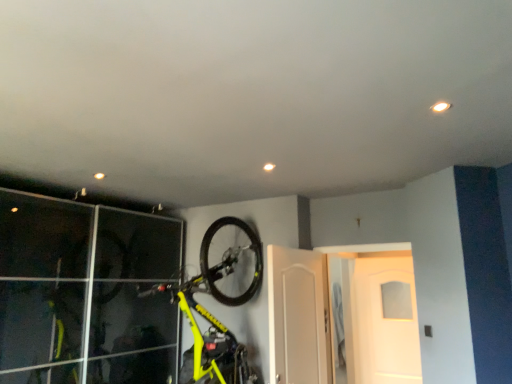
This screenshot has width=512, height=384. Find the location of `white glossy door at center, arranged as the 2th door when viewed from the back`. white glossy door at center, arranged as the 2th door when viewed from the back is located at coordinates (342, 315).

Find the location of `white glossy door at center, the third door when ordered from front to back`. white glossy door at center, the third door when ordered from front to back is located at coordinates (341, 319).

The height and width of the screenshot is (384, 512). I want to click on white glossy door at center, the second door viewed from the front, so click(342, 315).

Does white matte door at center, placed as the 1th door when sorted from front to back, lie behind white glossy door at center, which is the 1th door in back-to-front order?

No, white matte door at center, placed as the 1th door when sorted from front to back, is closer to the viewer.

From a real-world perspective, is white matte door at center, the 3th door in the back-to-front sequence, beneath white glossy door at center, which is the 1th door in back-to-front order?

No, from a real-world perspective, white matte door at center, the 3th door in the back-to-front sequence, is not below white glossy door at center, which is the 1th door in back-to-front order.

Can you confirm if white matte door at center, the 3th door in the back-to-front sequence, is bigger than white glossy door at center, the third door when ordered from front to back?

Actually, white matte door at center, the 3th door in the back-to-front sequence, might be smaller than white glossy door at center, the third door when ordered from front to back.

Are white matte door at center, placed as the 1th door when sorted from front to back, and white glossy door at center, which is the 1th door in back-to-front order, far apart?

white matte door at center, placed as the 1th door when sorted from front to back, is actually quite close to white glossy door at center, which is the 1th door in back-to-front order.

Is white glossy door at center, which is the 1th door in back-to-front order, inside yellow matte bicycle at upper center?

No, white glossy door at center, which is the 1th door in back-to-front order, is located outside of yellow matte bicycle at upper center.

Based on their positions, is yellow matte bicycle at upper center located to the left or right of white glossy door at center, which is the 1th door in back-to-front order?

From the image, it's evident that yellow matte bicycle at upper center is to the left of white glossy door at center, which is the 1th door in back-to-front order.

Is point (252, 292) positioned before point (338, 374)?

Yes, point (252, 292) is in front of point (338, 374).

From the image's perspective, which one is positioned lower, white glossy door at center, which is the 1th door in back-to-front order, or yellow matte bicycle at upper center?

From the image's view, white glossy door at center, which is the 1th door in back-to-front order, is below.

Based on the photo, considering the positions of objects white glossy door at center, the third door when ordered from front to back, and yellow matte bicycle at upper center in the image provided, who is more to the left, white glossy door at center, the third door when ordered from front to back, or yellow matte bicycle at upper center?

Result: Positioned to the left is yellow matte bicycle at upper center.

The width and height of the screenshot is (512, 384). Identify the location of bicycle above the white glossy door at center, the third door when ordered from front to back (from the image's perspective). (220, 301).

Does white glossy door at center, which is the 1th door in back-to-front order, have a lesser height compared to yellow matte bicycle at upper center?

Yes.

Can you confirm if yellow matte bicycle at upper center is wider than white glossy door at center, arranged as the 2th door when viewed from the back?

Indeed, yellow matte bicycle at upper center has a greater width compared to white glossy door at center, arranged as the 2th door when viewed from the back.

Which point is more distant from viewer, (246,380) or (321,282)?

Positioned behind is point (321,282).

Based on the photo, considering the relative positions of yellow matte bicycle at upper center and white glossy door at center, arranged as the 2th door when viewed from the back, in the image provided, is yellow matte bicycle at upper center to the right of white glossy door at center, arranged as the 2th door when viewed from the back, from the viewer's perspective?

Incorrect, yellow matte bicycle at upper center is not on the right side of white glossy door at center, arranged as the 2th door when viewed from the back.

Between yellow matte bicycle at upper center and white glossy door at center, arranged as the 2th door when viewed from the back, which one has larger size?

Bigger between the two is yellow matte bicycle at upper center.

In the scene shown: Which object is positioned more to the right, white glossy door at center, arranged as the 2th door when viewed from the back, or yellow matte bicycle at upper center?

white glossy door at center, arranged as the 2th door when viewed from the back, is more to the right.

From the image's perspective, would you say white glossy door at center, arranged as the 2th door when viewed from the back, is shown under yellow matte bicycle at upper center?

Yes.

Is white glossy door at center, arranged as the 2th door when viewed from the back, touching yellow matte bicycle at upper center?

No.

Is white glossy door at center, the second door viewed from the front, positioned before yellow matte bicycle at upper center?

No.

Considering the positions of point (366, 312) and point (333, 308), is point (366, 312) closer or farther from the camera than point (333, 308)?

Point (366, 312) is positioned farther from the camera compared to point (333, 308).

Is white glossy door at center, arranged as the 2th door when viewed from the back, far from white glossy door at center, the third door when ordered from front to back?

Actually, white glossy door at center, arranged as the 2th door when viewed from the back, and white glossy door at center, the third door when ordered from front to back, are a little close together.

Who is more distant, white glossy door at center, the second door viewed from the front, or white glossy door at center, which is the 1th door in back-to-front order?

white glossy door at center, which is the 1th door in back-to-front order, is behind.

Considering the relative positions of white glossy door at center, arranged as the 2th door when viewed from the back, and white glossy door at center, which is the 1th door in back-to-front order, in the image provided, is white glossy door at center, arranged as the 2th door when viewed from the back, to the left or to the right of white glossy door at center, which is the 1th door in back-to-front order,?

Clearly, white glossy door at center, arranged as the 2th door when viewed from the back, is on the right of white glossy door at center, which is the 1th door in back-to-front order, in the image.

Does white glossy door at center, arranged as the 2th door when viewed from the back, have a lesser height compared to white matte door at center, placed as the 1th door when sorted from front to back?

Incorrect, the height of white glossy door at center, arranged as the 2th door when viewed from the back, does not fall short of that of white matte door at center, placed as the 1th door when sorted from front to back.

Consider the image. Is white glossy door at center, arranged as the 2th door when viewed from the back, aimed at white matte door at center, the 3th door in the back-to-front sequence?

Yes, white glossy door at center, arranged as the 2th door when viewed from the back, is oriented towards white matte door at center, the 3th door in the back-to-front sequence.

Would you consider white glossy door at center, arranged as the 2th door when viewed from the back, to be distant from white matte door at center, placed as the 1th door when sorted from front to back?

white glossy door at center, arranged as the 2th door when viewed from the back, is actually quite close to white matte door at center, placed as the 1th door when sorted from front to back.

In the image, there is a white matte door at center, the 3th door in the back-to-front sequence. At what (x,y) coordinates should I click in order to perform the action: click on door below it (from a real-world perspective). Please return your answer as a coordinate pair (x, y). The height and width of the screenshot is (384, 512). Looking at the image, I should click on (341, 319).

From the image's perspective, which door is the 3rd one below the yellow matte bicycle at upper center? Please provide its 2D coordinates.

[(341, 319)]

Based on their spatial positions, is white glossy door at center, arranged as the 2th door when viewed from the back, or white glossy door at center, which is the 1th door in back-to-front order, further from white matte door at center, placed as the 1th door when sorted from front to back?

white glossy door at center, which is the 1th door in back-to-front order, lies further to white matte door at center, placed as the 1th door when sorted from front to back, than the other object.

Estimate the real-world distances between objects in this image. Which object is further from yellow matte bicycle at upper center, white matte door at center, the 3th door in the back-to-front sequence, or white glossy door at center, the third door when ordered from front to back?

white glossy door at center, the third door when ordered from front to back.

From the image, which object appears to be nearer to yellow matte bicycle at upper center, white matte door at center, placed as the 1th door when sorted from front to back, or white glossy door at center, the second door viewed from the front?

Based on the image, white matte door at center, placed as the 1th door when sorted from front to back, appears to be nearer to yellow matte bicycle at upper center.

Based on their spatial positions, is white glossy door at center, arranged as the 2th door when viewed from the back, or white matte door at center, placed as the 1th door when sorted from front to back, closer to white glossy door at center, the third door when ordered from front to back?

The object closer to white glossy door at center, the third door when ordered from front to back, is white glossy door at center, arranged as the 2th door when viewed from the back.

Looking at the image, which one is located further to yellow matte bicycle at upper center, white glossy door at center, arranged as the 2th door when viewed from the back, or white matte door at center, the 3th door in the back-to-front sequence?

The object further to yellow matte bicycle at upper center is white glossy door at center, arranged as the 2th door when viewed from the back.

In the scene shown: Considering their positions, is white matte door at center, the 3th door in the back-to-front sequence, positioned closer to white glossy door at center, which is the 1th door in back-to-front order, than yellow matte bicycle at upper center?

Based on the image, white matte door at center, the 3th door in the back-to-front sequence, appears to be nearer to white glossy door at center, which is the 1th door in back-to-front order.

Looking at the image, which one is located closer to white glossy door at center, arranged as the 2th door when viewed from the back, white glossy door at center, the third door when ordered from front to back, or yellow matte bicycle at upper center?

yellow matte bicycle at upper center is positioned closer to the anchor white glossy door at center, arranged as the 2th door when viewed from the back.

Considering their positions, is yellow matte bicycle at upper center positioned further to white glossy door at center, the second door viewed from the front, than white matte door at center, placed as the 1th door when sorted from front to back?

yellow matte bicycle at upper center lies further to white glossy door at center, the second door viewed from the front, than the other object.

Find the location of `door between white matte door at center, the 3th door in the back-to-front sequence, and white glossy door at center, which is the 1th door in back-to-front order, along the z-axis`. door between white matte door at center, the 3th door in the back-to-front sequence, and white glossy door at center, which is the 1th door in back-to-front order, along the z-axis is located at coordinates (342, 315).